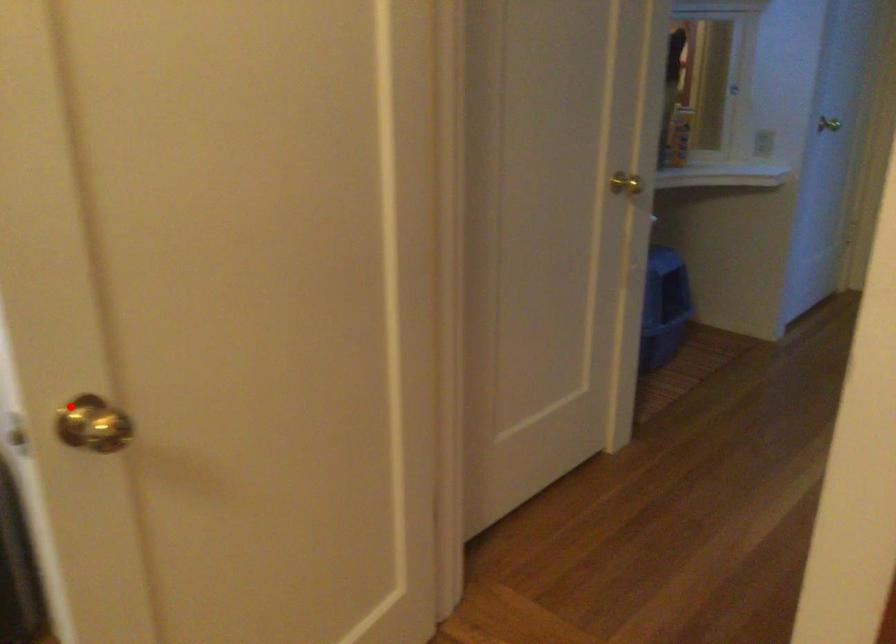
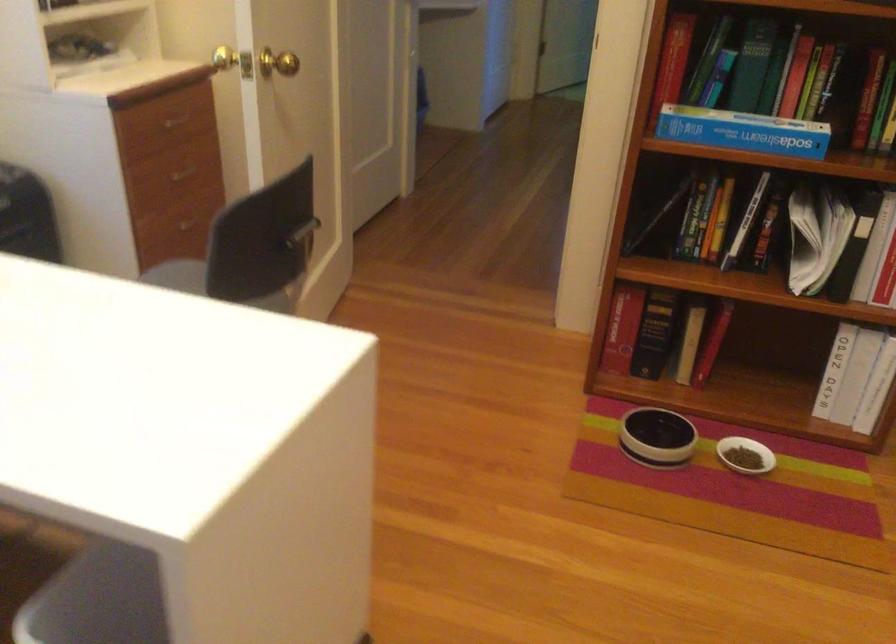
The point at the highlighted location is marked in the first image. Where is the corresponding point in the second image?

(233, 61)